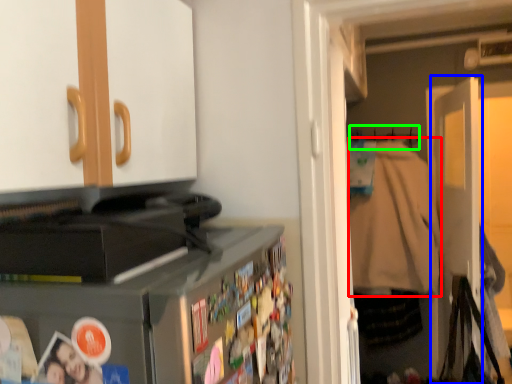
Question: Which object is the farthest from jacket (highlighted by a red box)? Choose among these: door (highlighted by a blue box) or hanger (highlighted by a green box).

Choices:
 (A) door
 (B) hanger

Answer: (B)